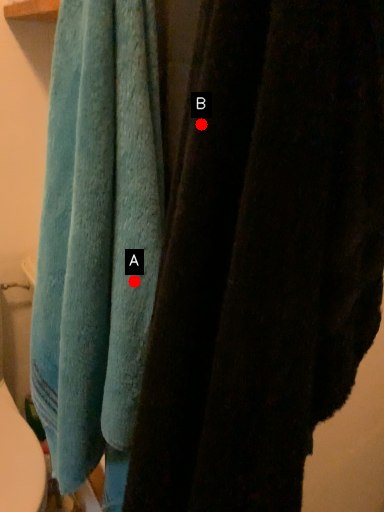
Question: Two points are circled on the image, labeled by A and B beside each circle. Among these points, which one is nearest to the camera?

Choices:
 (A) A is closer
 (B) B is closer

Answer: (B)